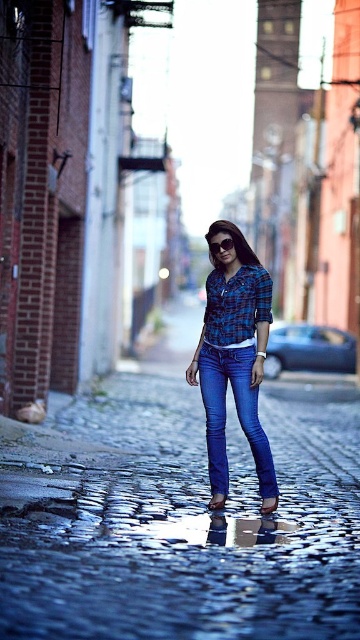
Between point (136, 529) and point (221, 248), which one is positioned in front?

Point (136, 529) is more forward.

Is shiny cobblestone street at center shorter than transparent plastic goggles at center?

In fact, shiny cobblestone street at center may be taller than transparent plastic goggles at center.

Who is more distant from viewer, (199,500) or (213,244)?

Point (213,244)

Image resolution: width=360 pixels, height=640 pixels. I want to click on shiny cobblestone street at center, so click(x=178, y=518).

Can you confirm if blue denim jeans at center is positioned to the right of blue plaid shirt at center?

In fact, blue denim jeans at center is to the left of blue plaid shirt at center.

Can you confirm if blue denim jeans at center is wider than blue plaid shirt at center?

Correct, the width of blue denim jeans at center exceeds that of blue plaid shirt at center.

Does point (227, 273) come farther from viewer compared to point (231, 326)?

That is True.

Locate an element on the screen. Image resolution: width=360 pixels, height=640 pixels. blue denim jeans at center is located at coordinates (234, 358).

Who is more forward, (218, 316) or (232, 241)?

Point (218, 316) is in front.

Is blue plaid shirt at center positioned at the back of transparent plastic goggles at center?

No, blue plaid shirt at center is in front of transparent plastic goggles at center.

The image size is (360, 640). In order to click on blue plaid shirt at center in this screenshot , I will do `click(236, 305)`.

What are the coordinates of `blue plaid shirt at center` in the screenshot? It's located at (236, 305).